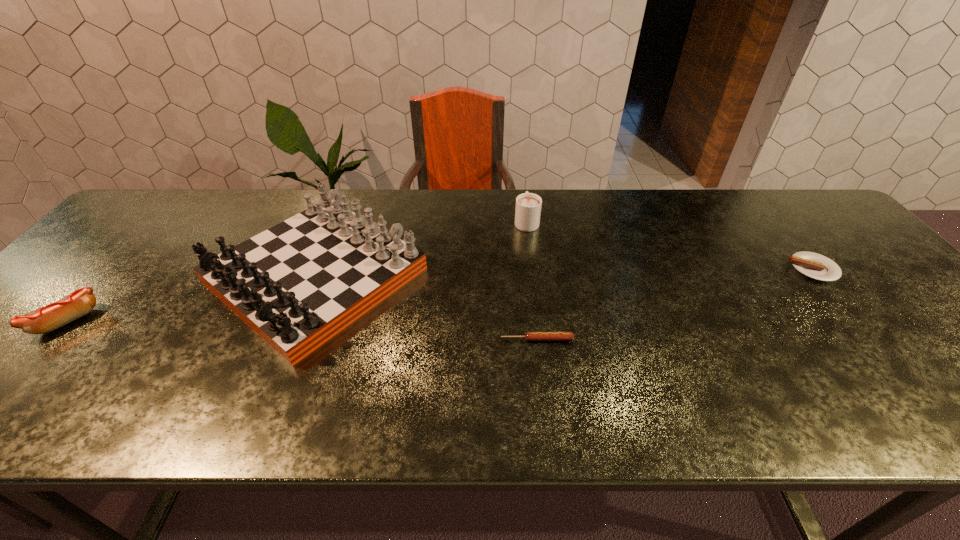
Where is `empty location between the third shortest object and the gameboard`? This screenshot has height=540, width=960. empty location between the third shortest object and the gameboard is located at coordinates pos(192,298).

Image resolution: width=960 pixels, height=540 pixels. What are the coordinates of `free space between the cappuccino and the tallest object` in the screenshot? It's located at (421, 248).

The height and width of the screenshot is (540, 960). I want to click on empty space between the leftmost object and the gameboard, so click(x=192, y=298).

Where is `vacant area between the second object from left to right and the second shortest object`? This screenshot has height=540, width=960. vacant area between the second object from left to right and the second shortest object is located at coordinates (564, 272).

This screenshot has height=540, width=960. Identify the location of free space between the second sausage from right to left and the cappuccino. (532, 280).

Find the location of a particular element. This screenshot has width=960, height=540. object that stands as the fourth closest to the second object from left to right is located at coordinates (816, 266).

Identify which object is located as the nearest to the gameboard. Please provide its 2D coordinates. Your answer should be formatted as a tuple, i.e. [(x, y)], where the tuple contains the x and y coordinates of a point satisfying the conditions above.

[(530, 336)]

Identify the location of sausage identified as the closest to the tallest object. The image size is (960, 540). (530, 336).

Identify which sausage is the third closest to the tallest object. Please provide its 2D coordinates. Your answer should be formatted as a tuple, i.e. [(x, y)], where the tuple contains the x and y coordinates of a point satisfying the conditions above.

[(816, 266)]

Where is `free space that satisfies the following two spatial constraints: 1. on the back side of the gameboard; 2. on the right side of the second shortest sausage`? The image size is (960, 540). free space that satisfies the following two spatial constraints: 1. on the back side of the gameboard; 2. on the right side of the second shortest sausage is located at coordinates (319, 269).